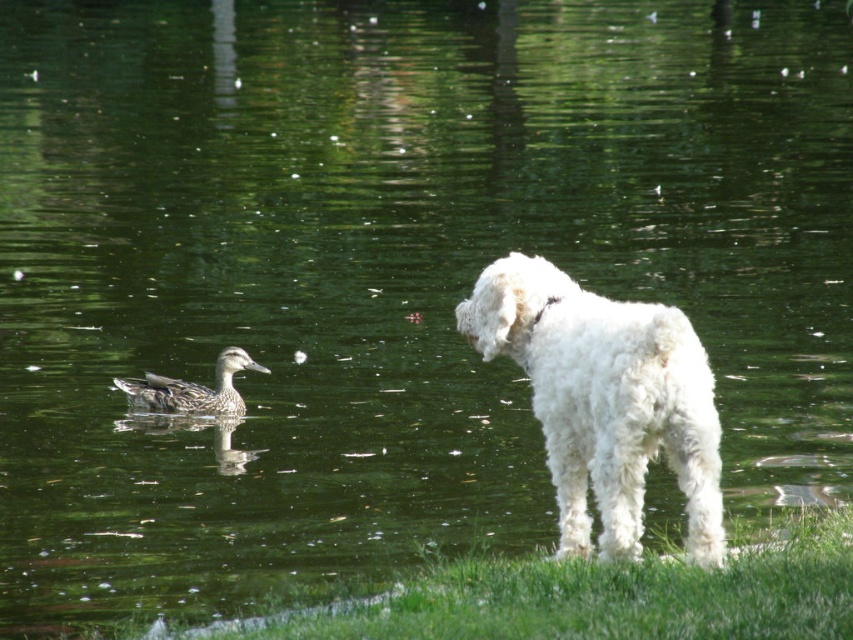
Question: Does white fluffy dog at center come behind brown speckled duck at left?

Choices:
 (A) yes
 (B) no

Answer: (B)

Question: Is green grass at lower right to the right of brown speckled duck at left from the viewer's perspective?

Choices:
 (A) yes
 (B) no

Answer: (A)

Question: Which object is positioned farthest from the brown speckled duck at left?

Choices:
 (A) green grass at lower right
 (B) white fluffy dog at center

Answer: (A)

Question: Which of the following is the closest to the observer?

Choices:
 (A) (584, 608)
 (B) (213, 394)

Answer: (A)

Question: Which object is the farthest from the green grass at lower right?

Choices:
 (A) brown speckled duck at left
 (B) white fluffy dog at center

Answer: (A)

Question: Does white fluffy dog at center appear under green grass at lower right?

Choices:
 (A) yes
 (B) no

Answer: (B)